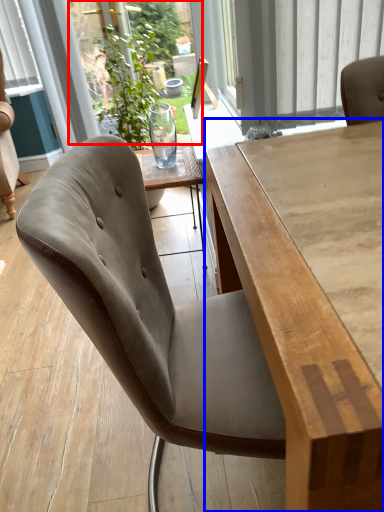
Question: Among these objects, which one is nearest to the camera, window screen (highlighted by a red box) or table (highlighted by a blue box)?

Choices:
 (A) window screen
 (B) table

Answer: (B)